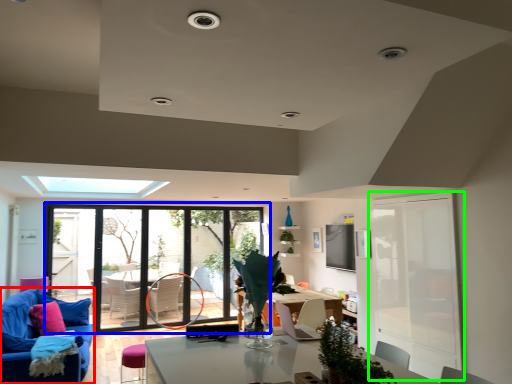
Question: Based on their relative distances, which object is nearer to studio couch (highlighted by a red box)? Choose from window (highlighted by a blue box) and screen door (highlighted by a green box).

Choices:
 (A) window
 (B) screen door

Answer: (A)